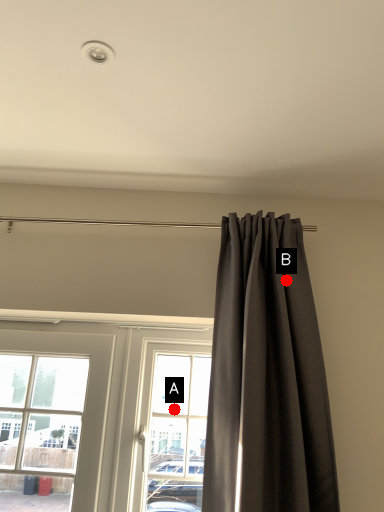
Question: Two points are circled on the image, labeled by A and B beside each circle. Which point is further to the camera?

Choices:
 (A) A is further
 (B) B is further

Answer: (A)